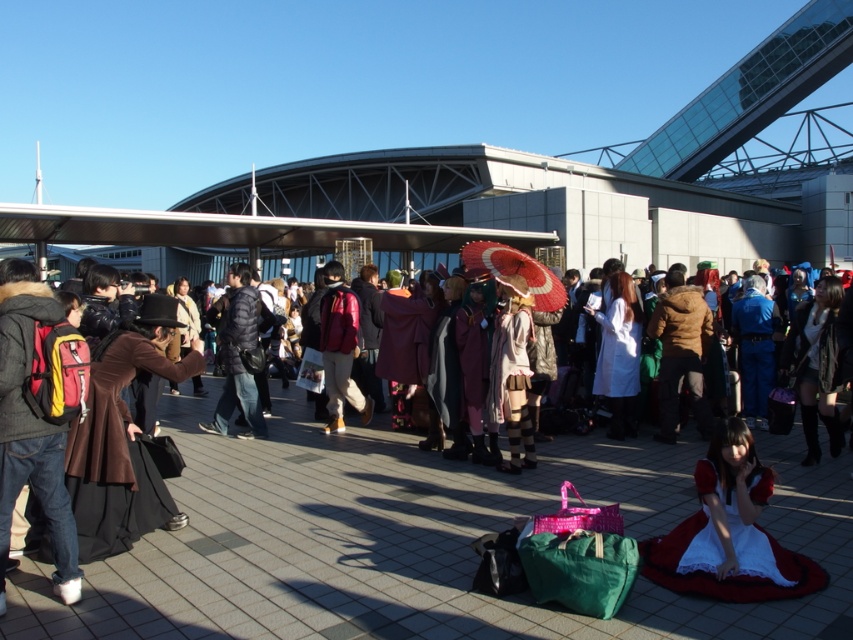
You are standing at the convention center and want to take a photo of two points in the scene. The first point is at coordinate point(184, 596) and the second point is at coordinate point(679, 577). Which point is closer to you?

Point(184, 596) is closer to the viewer than point(679, 577).